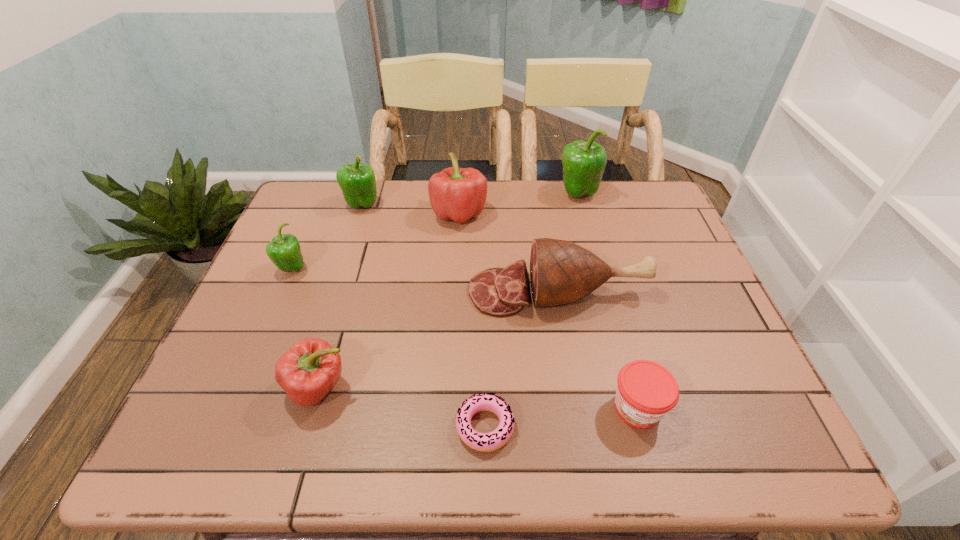
Where is `free space located on the front of the leftmost object`? The height and width of the screenshot is (540, 960). free space located on the front of the leftmost object is located at coordinates (267, 329).

The image size is (960, 540). I want to click on vacant space located 0.370m on the right of the nearer pink bell pepper, so pos(530,388).

You are a GUI agent. You are given a task and a screenshot of the screen. Output one action in this format:
    pyautogui.click(x=<x>, y=<y>)
    Task: Click on the vacant space situated on the right of the shortest object
    
    Given the screenshot: What is the action you would take?
    pyautogui.click(x=700, y=427)

You are a GUI agent. You are given a task and a screenshot of the screen. Output one action in this format:
    pyautogui.click(x=<x>, y=<y>)
    Task: Click on the bell pepper that is at the near edge
    
    Given the screenshot: What is the action you would take?
    pyautogui.click(x=308, y=371)

The height and width of the screenshot is (540, 960). In order to click on jam that is at the near edge in this screenshot , I will do `click(646, 391)`.

Locate an element on the screen. The width and height of the screenshot is (960, 540). doughnut at the near edge is located at coordinates (485, 442).

Locate an element on the screen. object positioned at the right edge is located at coordinates (561, 272).

Where is `object present at the far left corner`? The image size is (960, 540). object present at the far left corner is located at coordinates (357, 181).

Identify the location of vacant region at the far edge of the desktop. (396, 198).

Find the location of a particular element. The height and width of the screenshot is (540, 960). vacant space at the near edge of the desktop is located at coordinates tap(562, 451).